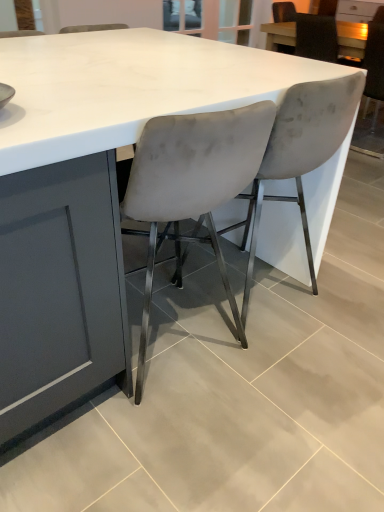
Image resolution: width=384 pixels, height=512 pixels. What do you see at coordinates (300, 153) in the screenshot? I see `velvet grey chair at center, the second chair viewed from the back` at bounding box center [300, 153].

The width and height of the screenshot is (384, 512). Find the location of `velvet gray chair at upper right, which is the third chair from front to back`. velvet gray chair at upper right, which is the third chair from front to back is located at coordinates (372, 88).

The image size is (384, 512). Find the location of `matte white table at upper right`. matte white table at upper right is located at coordinates (352, 39).

Considering the positions of objects velvet grey chair at center, which appears as the third chair when viewed from the back, and matte white table at upper right in the image provided, who is more to the left, velvet grey chair at center, which appears as the third chair when viewed from the back, or matte white table at upper right?

velvet grey chair at center, which appears as the third chair when viewed from the back, is more to the left.

Does velvet grey chair at center, which appears as the third chair when viewed from the back, contain matte white table at upper right?

Definitely not — matte white table at upper right is not inside velvet grey chair at center, which appears as the third chair when viewed from the back.

Is velvet grey chair at center, the 1th chair when ordered from front to back, smaller than matte white table at upper right?

Incorrect, velvet grey chair at center, the 1th chair when ordered from front to back, is not smaller in size than matte white table at upper right.

Image resolution: width=384 pixels, height=512 pixels. I want to click on the 1st chair directly beneath the matte white table at upper right (from a real-world perspective), so click(192, 187).

Is matte white table at upper right facing away from velvet gray chair at upper right, which is the third chair from front to back?

No, velvet gray chair at upper right, which is the third chair from front to back, is not at the back of matte white table at upper right.

From the image's perspective, is matte white table at upper right on top of velvet gray chair at upper right, which is the third chair in left-to-right order?

Yes, from the image's perspective, matte white table at upper right is on top of velvet gray chair at upper right, which is the third chair in left-to-right order.

Does matte white table at upper right appear on the left side of velvet gray chair at upper right, which is the third chair in left-to-right order?

Yes.

Which of these two, matte white table at upper right or velvet gray chair at upper right, the first chair in the back-to-front sequence, is smaller?

With smaller size is matte white table at upper right.

Between velvet grey chair at center, which is counted as the second chair, starting from the right, and velvet grey chair at center, the 1th chair when ordered from front to back, which one is positioned behind?

Positioned behind is velvet grey chair at center, which is counted as the second chair, starting from the right.

In the image, is velvet grey chair at center, which is counted as the second chair, starting from the right, on the left side or the right side of velvet grey chair at center, the 1th chair when ordered from front to back?

In the image, velvet grey chair at center, which is counted as the second chair, starting from the right, appears on the right side of velvet grey chair at center, the 1th chair when ordered from front to back.

How different are the orientations of velvet grey chair at center, the second chair viewed from the back, and velvet grey chair at center, which is counted as the third chair, starting from the right, in degrees?

There is a 1.76-degree angle between the facing directions of velvet grey chair at center, the second chair viewed from the back, and velvet grey chair at center, which is counted as the third chair, starting from the right.

Would you say velvet grey chair at center, which ranks as the 2th chair in left-to-right order, is inside or outside velvet grey chair at center, which is counted as the third chair, starting from the right?

velvet grey chair at center, which ranks as the 2th chair in left-to-right order, cannot be found inside velvet grey chair at center, which is counted as the third chair, starting from the right.

Is point (208, 240) farther from camera compared to point (355, 100)?

Yes, it is behind point (355, 100).

Which is correct: velvet grey chair at center, which appears as the third chair when viewed from the back, is inside velvet grey chair at center, the second chair viewed from the back, or outside of it?

velvet grey chair at center, which appears as the third chair when viewed from the back, is located beyond the bounds of velvet grey chair at center, the second chair viewed from the back.

From the image's perspective, between velvet grey chair at center, which is counted as the third chair, starting from the right, and velvet grey chair at center, which is counted as the second chair, starting from the right, which one is located above?

velvet grey chair at center, which is counted as the second chair, starting from the right, is shown above in the image.

Is velvet grey chair at center, the second chair viewed from the back, turned away from matte white table at upper right?

No, velvet grey chair at center, the second chair viewed from the back,'s orientation is not away from matte white table at upper right.

Is point (274, 151) behind point (277, 32)?

No.

Which is behind, velvet grey chair at center, which is counted as the second chair, starting from the right, or matte white table at upper right?

matte white table at upper right is further from the camera.

Is there a large distance between velvet grey chair at center, which is counted as the second chair, starting from the right, and matte white table at upper right?

Yes, velvet grey chair at center, which is counted as the second chair, starting from the right, is far from matte white table at upper right.

Considering the relative sizes of matte white table at upper right and velvet grey chair at center, which ranks as the 2th chair in left-to-right order, in the image provided, is matte white table at upper right smaller than velvet grey chair at center, which ranks as the 2th chair in left-to-right order,?

Yes, matte white table at upper right is smaller than velvet grey chair at center, which ranks as the 2th chair in left-to-right order.

Would you consider matte white table at upper right to be distant from velvet grey chair at center, which appears as the second chair when viewed from the front?

Yes, matte white table at upper right and velvet grey chair at center, which appears as the second chair when viewed from the front, are quite far apart.

Considering the points (295, 35) and (276, 154), which point is behind, point (295, 35) or point (276, 154)?

The point (295, 35) is farther from the camera.

Could you tell me if matte white table at upper right is turned towards velvet grey chair at center, which appears as the second chair when viewed from the front?

No, matte white table at upper right is not aimed at velvet grey chair at center, which appears as the second chair when viewed from the front.

Identify the location of table located above the velvet grey chair at center, which is counted as the third chair, starting from the right (from the image's perspective). click(352, 39).

Which point is more forward, (342,44) or (223,166)?

The point (223,166) is in front.

From a real-world perspective, is matte white table at upper right on velvet grey chair at center, which appears as the third chair when viewed from the back?

Yes, from a real-world perspective, matte white table at upper right is over velvet grey chair at center, which appears as the third chair when viewed from the back

Considering the sizes of objects matte white table at upper right and velvet grey chair at center, the 1th chair when ordered from front to back, in the image provided, who is smaller, matte white table at upper right or velvet grey chair at center, the 1th chair when ordered from front to back,?

With smaller size is matte white table at upper right.

Image resolution: width=384 pixels, height=512 pixels. What are the coordinates of `table positioned vertically above the velvet grey chair at center, the 1th chair positioned from the left (from a real-world perspective)` in the screenshot? It's located at (352, 39).

In the image, there is a velvet gray chair at upper right, which is the third chair in left-to-right order. Identify the location of table above it (from the image's perspective). (352, 39).

Based on their spatial positions, is velvet gray chair at upper right, which is the third chair from front to back, or velvet grey chair at center, which is counted as the second chair, starting from the right, further from velvet grey chair at center, which is counted as the third chair, starting from the right?

The object further to velvet grey chair at center, which is counted as the third chair, starting from the right, is velvet gray chair at upper right, which is the third chair from front to back.

Looking at the image, which one is located closer to velvet grey chair at center, which is counted as the second chair, starting from the right, velvet grey chair at center, the 1th chair positioned from the left, or velvet gray chair at upper right, which is the third chair from front to back?

velvet grey chair at center, the 1th chair positioned from the left, lies closer to velvet grey chair at center, which is counted as the second chair, starting from the right, than the other object.

Based on their spatial positions, is velvet gray chair at upper right, placed as the first chair when sorted from right to left, or matte white table at upper right further from velvet grey chair at center, which appears as the third chair when viewed from the back?

The object further to velvet grey chair at center, which appears as the third chair when viewed from the back, is matte white table at upper right.

Looking at the image, which one is located further to velvet grey chair at center, the 1th chair positioned from the left, velvet grey chair at center, which appears as the second chair when viewed from the front, or velvet gray chair at upper right, which is the third chair from front to back?

velvet gray chair at upper right, which is the third chair from front to back.

Estimate the real-world distances between objects in this image. Which object is further from velvet grey chair at center, the 1th chair positioned from the left, velvet grey chair at center, which is counted as the second chair, starting from the right, or matte white table at upper right?

The object further to velvet grey chair at center, the 1th chair positioned from the left, is matte white table at upper right.

Considering their positions, is velvet gray chair at upper right, placed as the first chair when sorted from right to left, positioned closer to matte white table at upper right than velvet grey chair at center, which appears as the second chair when viewed from the front?

velvet gray chair at upper right, placed as the first chair when sorted from right to left, lies closer to matte white table at upper right than the other object.

Looking at this image, which object lies nearer to the anchor point matte white table at upper right, velvet grey chair at center, which is counted as the second chair, starting from the right, or velvet grey chair at center, the 1th chair when ordered from front to back?

velvet grey chair at center, which is counted as the second chair, starting from the right, is closer to matte white table at upper right.

Based on their spatial positions, is matte white table at upper right or velvet grey chair at center, which appears as the second chair when viewed from the front, further from velvet gray chair at upper right, placed as the first chair when sorted from right to left?

velvet grey chair at center, which appears as the second chair when viewed from the front, is further to velvet gray chair at upper right, placed as the first chair when sorted from right to left.

Where is `chair positioned between velvet grey chair at center, the second chair viewed from the back, and matte white table at upper right from near to far`? The height and width of the screenshot is (512, 384). chair positioned between velvet grey chair at center, the second chair viewed from the back, and matte white table at upper right from near to far is located at coordinates (372, 88).

Find the location of a particular element. chair between velvet grey chair at center, the 1th chair positioned from the left, and velvet gray chair at upper right, which is the third chair from front to back, in the front-back direction is located at coordinates (300, 153).